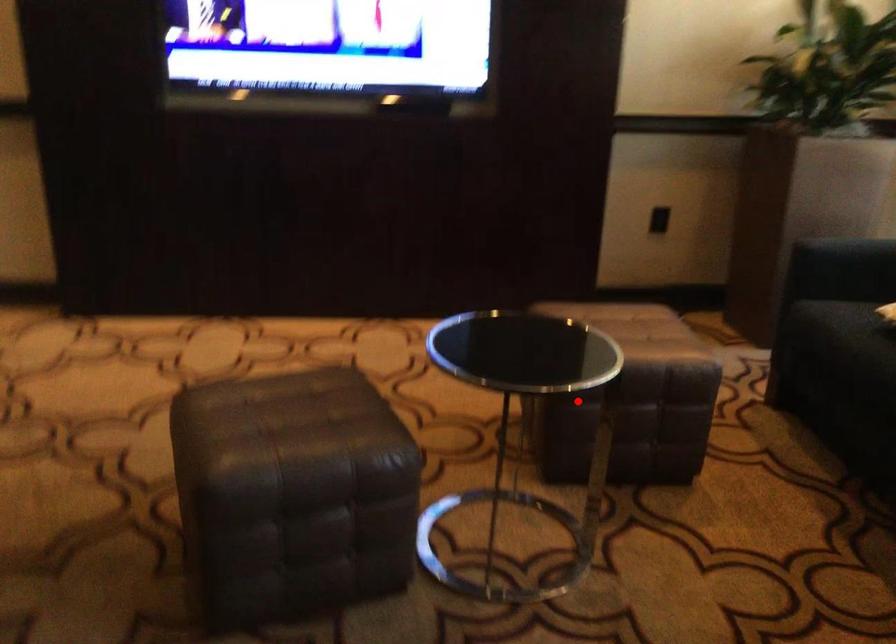
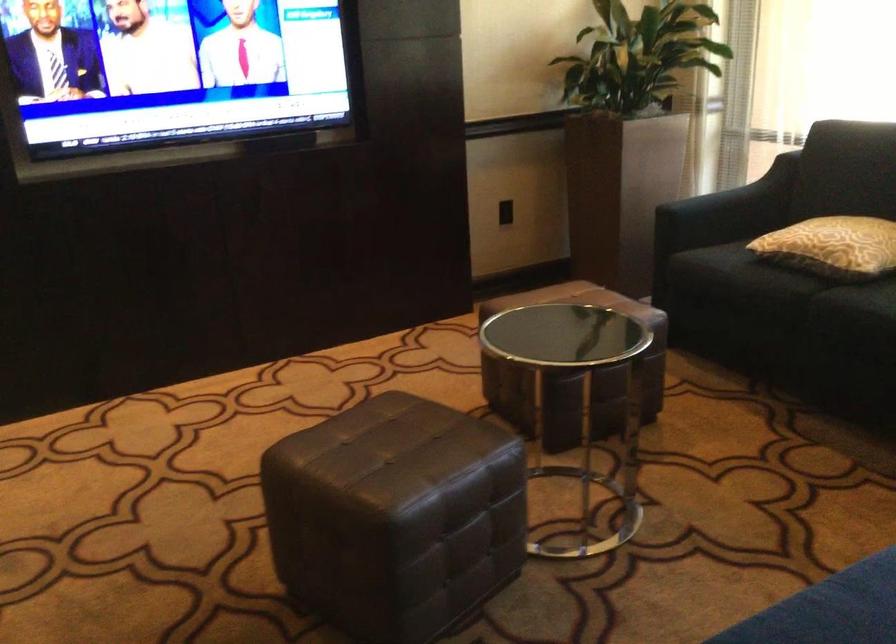
In the second image, find the point that corresponds to the highlighted location in the first image.

(573, 373)